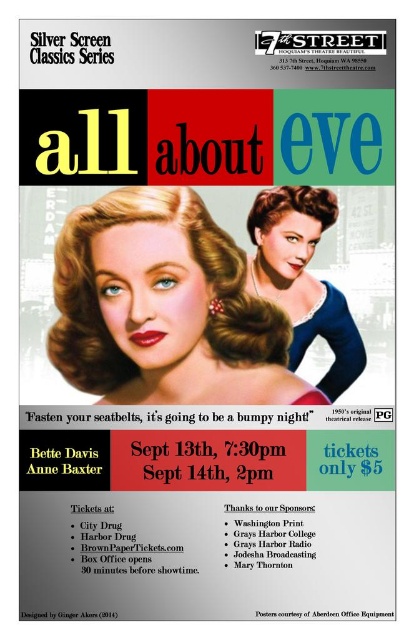
Between matte blonde hair at center and blue satin dress at center, which one appears on the left side from the viewer's perspective?

matte blonde hair at center

Is matte blonde hair at center thinner than blue satin dress at center?

No, matte blonde hair at center is not thinner than blue satin dress at center.

Is point (170, 209) closer to viewer compared to point (298, 256)?

That is True.

The image size is (414, 640). I want to click on matte blonde hair at center, so click(x=165, y=307).